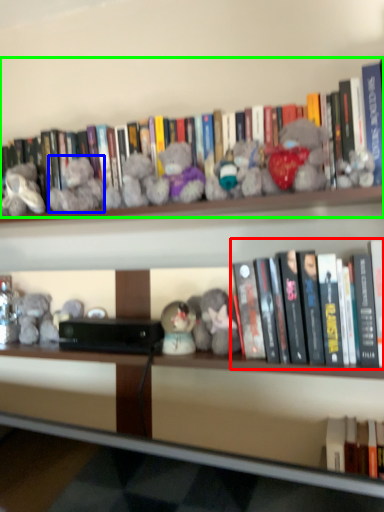
Question: Which object is positioned closest to book (highlighted by a red box)? Select from toy (highlighted by a blue box) and book (highlighted by a green box).

Choices:
 (A) toy
 (B) book

Answer: (B)